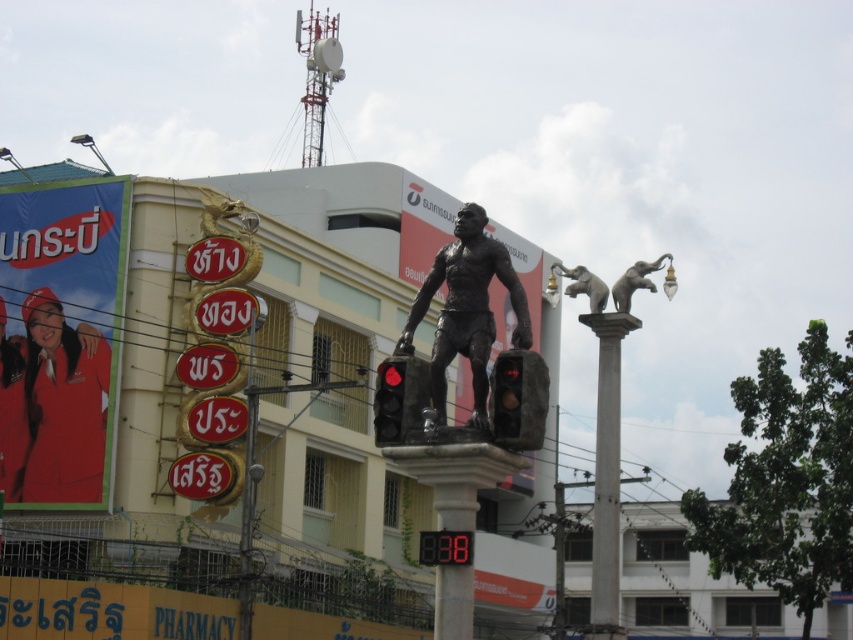
You are a delivery robot with a 1.6 meter wide package. You need to navigate between the bronze statue at center and the metallic traffic light at center. Can your package fit through the space between them?

The bronze statue at center and metallic traffic light at center are 1.55 meters apart from each other. Since your package is 1.6 meters wide, it cannot fit through the space between them.

You are a delivery drone flying above the statue. You need to land at the exact center of the matte black traffic light at center. What are the coordinates where you should land?

The coordinates for the exact center of the matte black traffic light at center are point (518, 400).

You are a tourist in this city and want to take a photo with the bronze statue at center and the gray metallic elephant at upper right. Since you can only stand in one spot, which object should you position yourself in front of to have both in your camera frame?

You should position yourself in front of the bronze statue at center because it is below the gray metallic elephant at upper right, so standing in front of the statue will allow both objects to be captured in the frame.